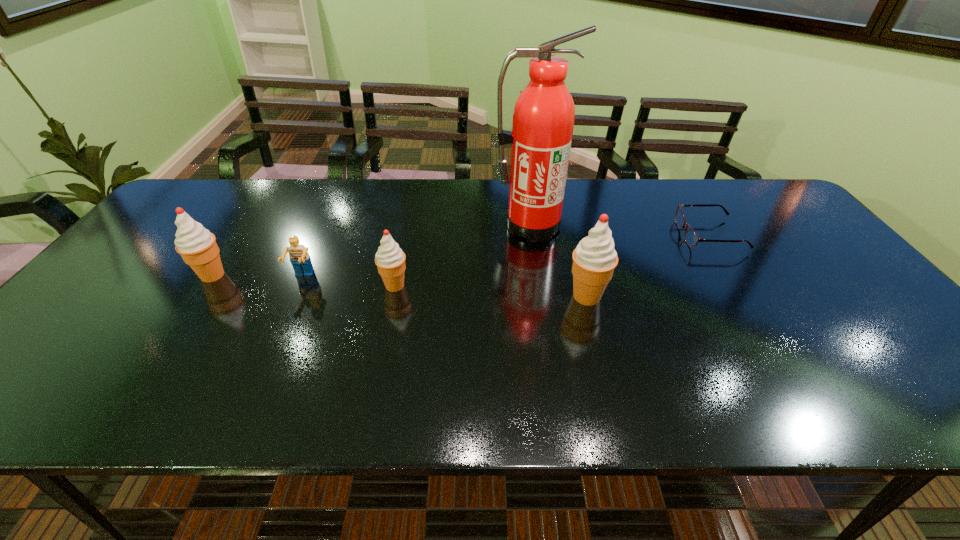
In the image, there is a desktop. Where is `vacant area at the far edge`? The height and width of the screenshot is (540, 960). vacant area at the far edge is located at coordinates (387, 213).

Find the location of a particular element. free space at the left edge of the desktop is located at coordinates (168, 221).

What are the coordinates of `free space at the right edge of the desktop` in the screenshot? It's located at (855, 332).

Where is `free space at the far left corner of the desktop`? free space at the far left corner of the desktop is located at coordinates (209, 198).

What are the coordinates of `vacant area between the third shortest object and the rightmost icecream` in the screenshot? It's located at 491,291.

Locate an element on the screen. This screenshot has height=540, width=960. vacant point located between the leftmost object and the fifth tallest object is located at coordinates (257, 276).

This screenshot has height=540, width=960. In order to click on vacant point located between the shortest object and the rightmost icecream in this screenshot , I will do `click(648, 266)`.

The image size is (960, 540). What are the coordinates of `free space between the second icecream from left to right and the rightmost icecream` in the screenshot? It's located at (491, 291).

What are the coordinates of `free space between the leftmost object and the Lego` in the screenshot? It's located at (257, 276).

Find the location of a particular element. The image size is (960, 540). free area in between the fire extinguisher and the rightmost icecream is located at coordinates (559, 261).